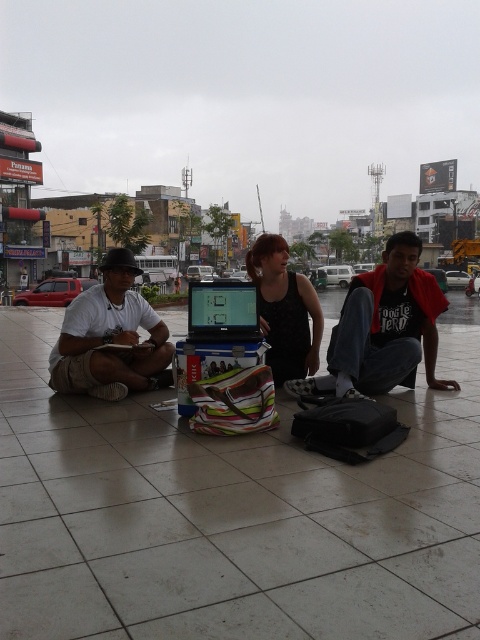
Question: Which of the following is the closest to the observer?

Choices:
 (A) (142, 353)
 (B) (192, 292)

Answer: (B)

Question: Does dark red cotton shirt at lower right appear on the left side of black matte tank top at center?

Choices:
 (A) no
 (B) yes

Answer: (A)

Question: Which point is closer to the camera?

Choices:
 (A) (132, 380)
 (B) (300, 364)
 (C) (342, 378)

Answer: (C)

Question: Is dark red cotton shirt at lower right thinner than white matte shirt at center?

Choices:
 (A) yes
 (B) no

Answer: (B)

Question: Which point is farther to the camera?

Choices:
 (A) dark red cotton shirt at lower right
 (B) white matte shirt at center
 (C) black matte tank top at center
 (D) black plastic laptop at center

Answer: (B)

Question: In this image, where is white matte shirt at center located relative to black matte tank top at center?

Choices:
 (A) below
 (B) above

Answer: (A)